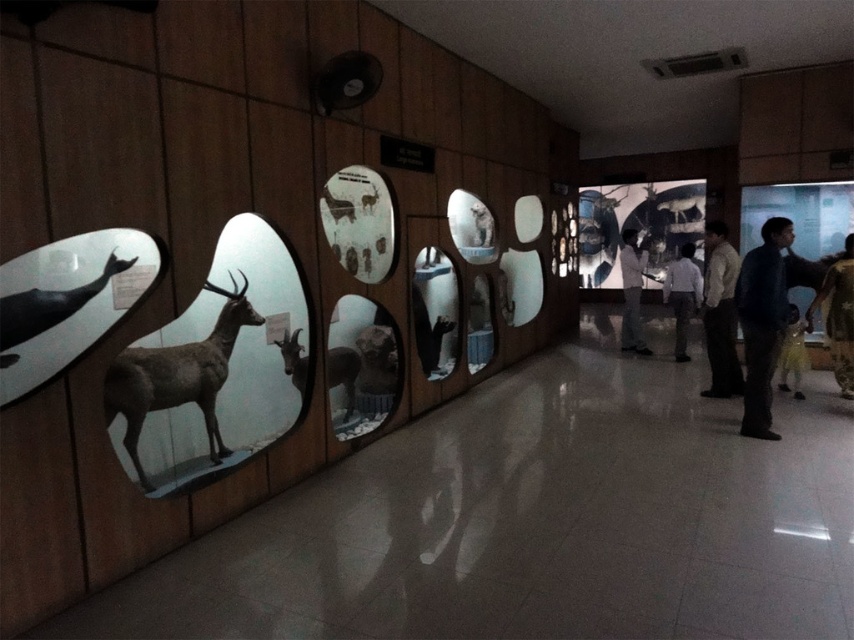
What do you see at coordinates (762, 323) in the screenshot?
I see `dark blue shirt at right` at bounding box center [762, 323].

Is point (763, 264) positioned behind point (796, 310)?

No, it is not.

Identify the location of dark blue shirt at right. (762, 323).

Between point (831, 284) and point (683, 205), which one is positioned in front?

Positioned in front is point (831, 284).

Where is `yellow fabric dress at lower right`? The width and height of the screenshot is (854, 640). yellow fabric dress at lower right is located at coordinates (838, 316).

Is point (4, 333) more distant than point (695, 284)?

No, (4, 333) is closer to viewer.

Can you confirm if matte black whale at left is positioned to the right of white shirt at center?

No, matte black whale at left is not to the right of white shirt at center.

Measure the distance between matte black whale at left and camera.

A distance of 2.66 meters exists between matte black whale at left and camera.

Find the location of `matte black whale at left`. matte black whale at left is located at coordinates (x=47, y=307).